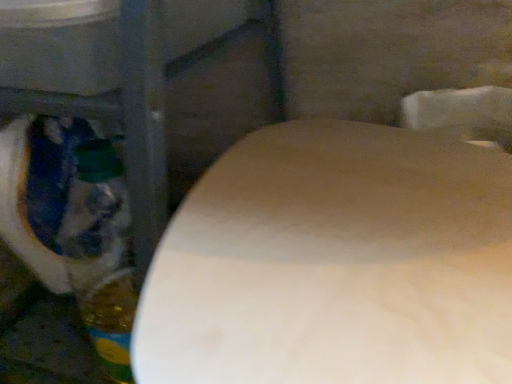
Where is `white matte toilet at center`? white matte toilet at center is located at coordinates (335, 263).

Describe the element at coordinates (335, 263) in the screenshot. I see `white matte toilet at center` at that location.

What are the coordinates of `white matte toilet at center` in the screenshot? It's located at point(335,263).